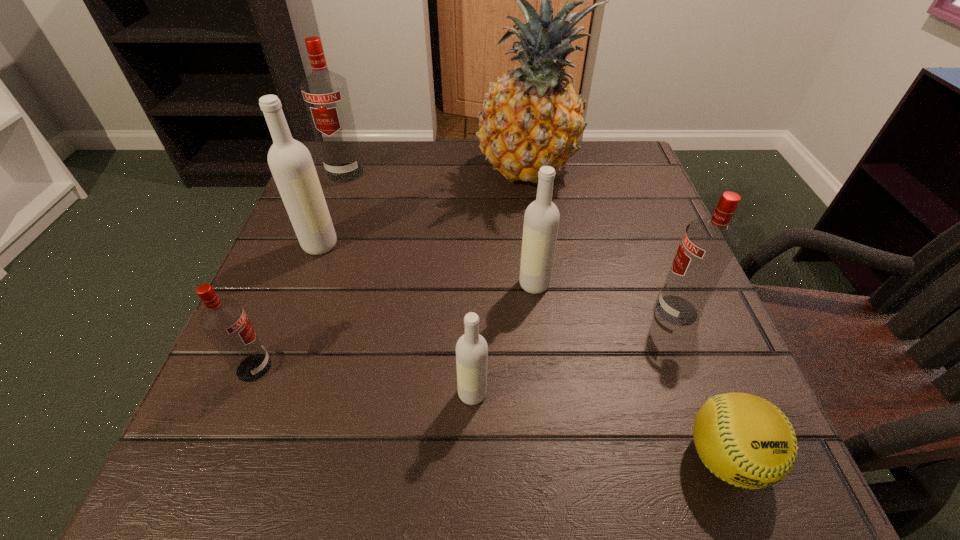
I want to click on free space between the smallest red vodka and the leftmost white vodka, so click(287, 306).

You are a GUI agent. You are given a task and a screenshot of the screen. Output one action in this format:
    pyautogui.click(x=<x>, y=<y>)
    Task: Click on the vacant area that lies between the third vodka from right to left and the leftmost white vodka
    This screenshot has width=960, height=540.
    Given the screenshot: What is the action you would take?
    pyautogui.click(x=396, y=319)

The image size is (960, 540). I want to click on empty space between the nearest red vodka and the nearest object, so click(x=490, y=413).

In order to click on vacant space in between the farthest vodka and the smallest red vodka in this screenshot , I will do `click(300, 270)`.

At what (x,y) coordinates should I click in order to perform the action: click on free area in between the biggest red vodka and the softball. Please return your answer as a coordinate pair (x, y). Looking at the image, I should click on (535, 315).

This screenshot has width=960, height=540. I want to click on vacant space in between the third farthest object and the farthest red vodka, so click(x=332, y=209).

Locate an element on the screen. Image resolution: width=960 pixels, height=540 pixels. vacant area that lies between the biggest red vodka and the smallest white vodka is located at coordinates (x=409, y=283).

At what (x,y) coordinates should I click in order to perform the action: click on empty space that is in between the tallest object and the smallest white vodka. Please return your answer as a coordinate pair (x, y). The width and height of the screenshot is (960, 540). Looking at the image, I should click on (501, 282).

Locate which object is the third closest to the biggest red vodka. Please provide its 2D coordinates. Your answer should be formatted as a tuple, i.e. [(x, y)], where the tuple contains the x and y coordinates of a point satisfying the conditions above.

[(541, 220)]

Select which object is the fourth closest to the third vodka from right to left. Please provide its 2D coordinates. Your answer should be formatted as a tuple, i.e. [(x, y)], where the tuple contains the x and y coordinates of a point satisfying the conditions above.

[(708, 245)]